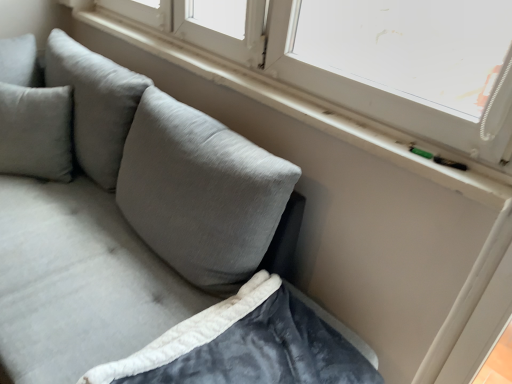
Question: Is point (130, 117) positioned closer to the camera than point (500, 82)?

Choices:
 (A) closer
 (B) farther

Answer: (B)

Question: From a real-world perspective, is velvet gray couch at lower left positioned above or below white plastic window at upper right?

Choices:
 (A) above
 (B) below

Answer: (B)

Question: Based on their relative distances, which object is nearer to the velvety dark gray blanket at lower left?

Choices:
 (A) velvet gray couch at lower left
 (B) white plastic window at upper right

Answer: (A)

Question: Which object is the farthest from the velvety dark gray blanket at lower left?

Choices:
 (A) velvet gray couch at lower left
 (B) white plastic window at upper right

Answer: (B)